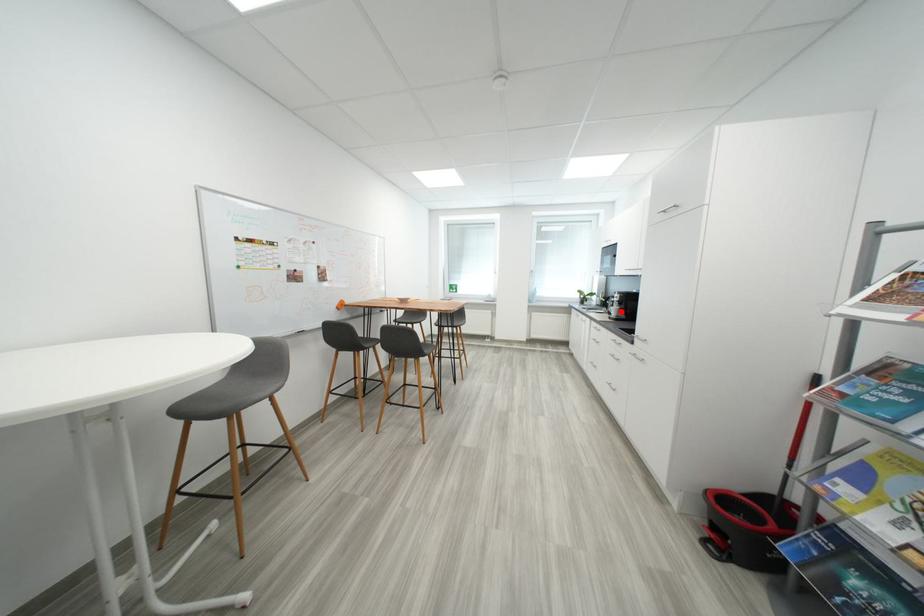
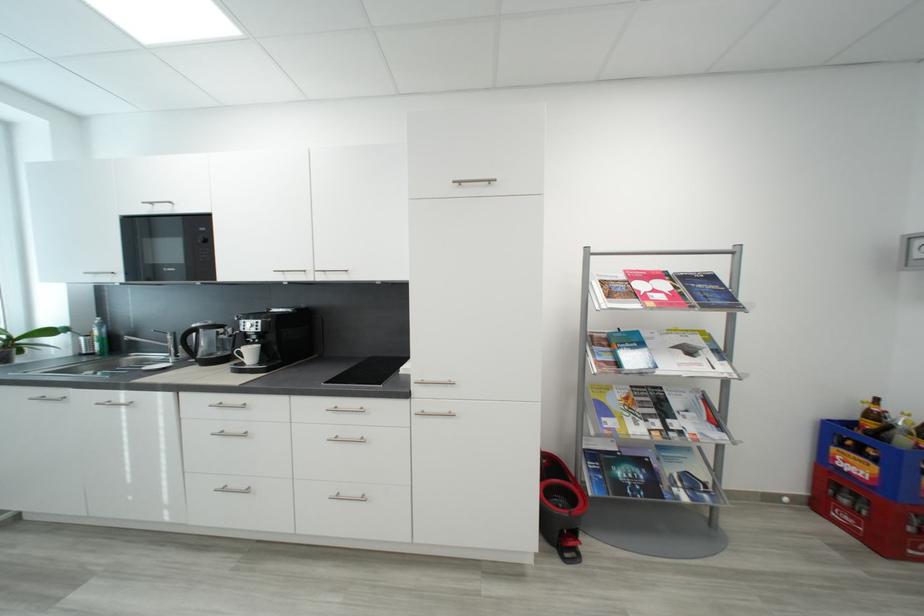
Question: I am providing you with two images of the same scene from different viewpoints. A red point is marked on the first image. At the location where the point appears in image 1, is it still visible in image 2?

Choices:
 (A) Yes
 (B) No

Answer: (A)